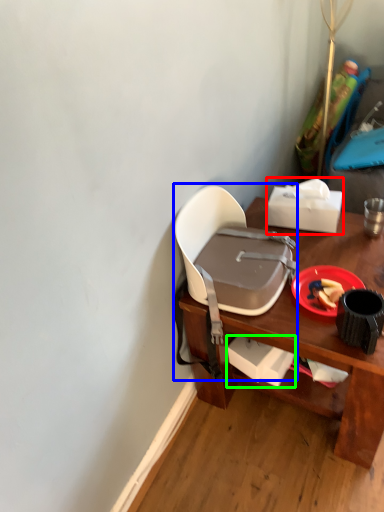
Question: Which object is positioned closest to box (highlighted by a red box)? Select from chair (highlighted by a blue box) and box (highlighted by a green box).

Choices:
 (A) chair
 (B) box

Answer: (A)